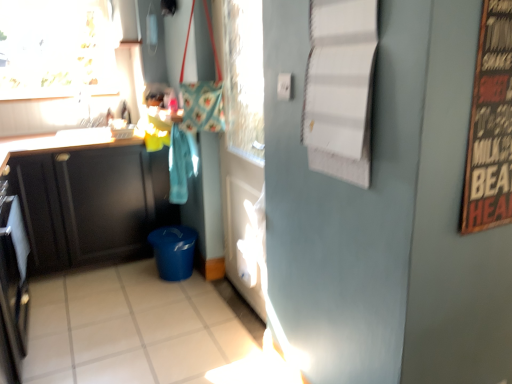
I want to click on vacant space that is to the left of white glossy door at center, so click(196, 304).